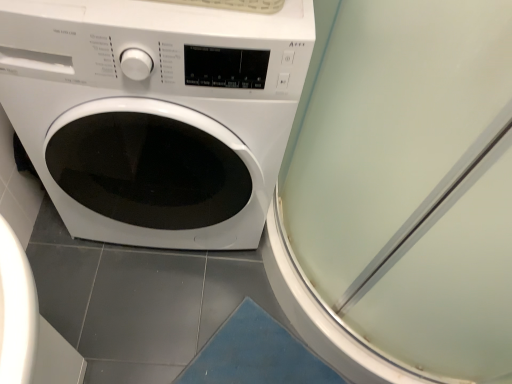
This screenshot has width=512, height=384. In order to click on white glossy washing machine at center in this screenshot , I will do `click(155, 114)`.

Measure the distance between point (x=249, y=247) and camera.

A distance of 4.40 feet exists between point (x=249, y=247) and camera.

Describe the element at coordinates (155, 114) in the screenshot. This screenshot has height=384, width=512. I see `white glossy washing machine at center` at that location.

What do you see at coordinates (401, 193) in the screenshot?
I see `transparent plastic screen door at upper right` at bounding box center [401, 193].

What are the coordinates of `transparent plastic screen door at upper right` in the screenshot? It's located at (401, 193).

I want to click on white glossy washing machine at center, so click(x=155, y=114).

Between white glossy washing machine at center and transparent plastic screen door at upper right, which one appears on the right side from the viewer's perspective?

From the viewer's perspective, transparent plastic screen door at upper right appears more on the right side.

Is white glossy washing machine at center in front of or behind transparent plastic screen door at upper right in the image?

In the image, white glossy washing machine at center appears behind transparent plastic screen door at upper right.

Between point (174, 158) and point (334, 293), which one is positioned in front?

The point (174, 158) is closer.

From the image's perspective, which is above, white glossy washing machine at center or transparent plastic screen door at upper right?

white glossy washing machine at center, from the image's perspective.

From a real-world perspective, is white glossy washing machine at center below transparent plastic screen door at upper right?

Correct, in the physical world, white glossy washing machine at center is lower than transparent plastic screen door at upper right.

Does white glossy washing machine at center have a lesser width compared to transparent plastic screen door at upper right?

Yes, white glossy washing machine at center is thinner than transparent plastic screen door at upper right.

Considering the sizes of white glossy washing machine at center and transparent plastic screen door at upper right in the image, is white glossy washing machine at center taller or shorter than transparent plastic screen door at upper right?

white glossy washing machine at center is taller than transparent plastic screen door at upper right.

Can you confirm if white glossy washing machine at center is smaller than transparent plastic screen door at upper right?

No, white glossy washing machine at center is not smaller than transparent plastic screen door at upper right.

From the picture: Is white glossy washing machine at center spatially inside transparent plastic screen door at upper right, or outside of it?

white glossy washing machine at center cannot be found inside transparent plastic screen door at upper right.

Based on the photo, are white glossy washing machine at center and transparent plastic screen door at upper right far apart?

No.

Is white glossy washing machine at center positioned with its back to transparent plastic screen door at upper right?

No, white glossy washing machine at center is not facing away from transparent plastic screen door at upper right.

Looking at this image, what's the angular difference between white glossy washing machine at center and transparent plastic screen door at upper right's facing directions?

→ The angle between the facing direction of white glossy washing machine at center and the facing direction of transparent plastic screen door at upper right is 5.41e-05 degrees.

How distant is white glossy washing machine at center from transparent plastic screen door at upper right?

white glossy washing machine at center and transparent plastic screen door at upper right are 12.79 inches apart.

Where is `washing machine behind the transparent plastic screen door at upper right`? The height and width of the screenshot is (384, 512). washing machine behind the transparent plastic screen door at upper right is located at coordinates (155, 114).

Which is more to the right, transparent plastic screen door at upper right or white glossy washing machine at center?

Positioned to the right is transparent plastic screen door at upper right.

Which is in front, transparent plastic screen door at upper right or white glossy washing machine at center?

Positioned in front is transparent plastic screen door at upper right.

Is point (505, 151) less distant than point (93, 21)?

That is True.

From the image's perspective, is transparent plastic screen door at upper right located beneath white glossy washing machine at center?

Yes, from the image's perspective, transparent plastic screen door at upper right is beneath white glossy washing machine at center.

Based on the photo, from a real-world perspective, which object rests below the other?

In real-world perspective, white glossy washing machine at center is lower.

Considering the relative sizes of transparent plastic screen door at upper right and white glossy washing machine at center in the image provided, is transparent plastic screen door at upper right thinner than white glossy washing machine at center?

In fact, transparent plastic screen door at upper right might be wider than white glossy washing machine at center.

Considering the sizes of objects transparent plastic screen door at upper right and white glossy washing machine at center in the image provided, who is shorter, transparent plastic screen door at upper right or white glossy washing machine at center?

Standing shorter between the two is transparent plastic screen door at upper right.

Can you confirm if transparent plastic screen door at upper right is bigger than white glossy washing machine at center?

No, transparent plastic screen door at upper right is not bigger than white glossy washing machine at center.

Would you say transparent plastic screen door at upper right is inside or outside white glossy washing machine at center?

transparent plastic screen door at upper right is spatially situated outside white glossy washing machine at center.

Are transparent plastic screen door at upper right and white glossy washing machine at center far apart?

transparent plastic screen door at upper right is near white glossy washing machine at center, not far away.

Looking at this image, is white glossy washing machine at center at the back of transparent plastic screen door at upper right?

No, transparent plastic screen door at upper right is not facing the opposite direction of white glossy washing machine at center.

How many degrees apart are the facing directions of transparent plastic screen door at upper right and white glossy washing machine at center?

The facing directions of transparent plastic screen door at upper right and white glossy washing machine at center are 5.41e-05 degrees apart.

How much distance is there between transparent plastic screen door at upper right and white glossy washing machine at center?

They are 12.79 inches apart.

You are a GUI agent. You are given a task and a screenshot of the screen. Output one action in this format:
    pyautogui.click(x=<x>, y=<y>)
    Task: Click on the washing machine that appears above the transparent plastic screen door at upper right (from the image's perspective)
    The image size is (512, 384).
    Given the screenshot: What is the action you would take?
    pyautogui.click(x=155, y=114)

At what (x,y) coordinates should I click in order to perform the action: click on screen door that appears in front of the white glossy washing machine at center. Please return your answer as a coordinate pair (x, y). This screenshot has height=384, width=512. Looking at the image, I should click on (401, 193).

This screenshot has width=512, height=384. In the image, there is a transparent plastic screen door at upper right. Identify the location of washing machine below it (from a real-world perspective). (155, 114).